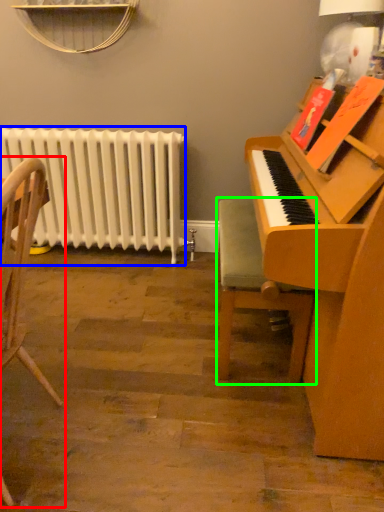
Question: Based on their relative distances, which object is nearer to chair (highlighted by a red box)? Choose from radiator (highlighted by a blue box) and chair (highlighted by a green box).

Choices:
 (A) radiator
 (B) chair

Answer: (B)